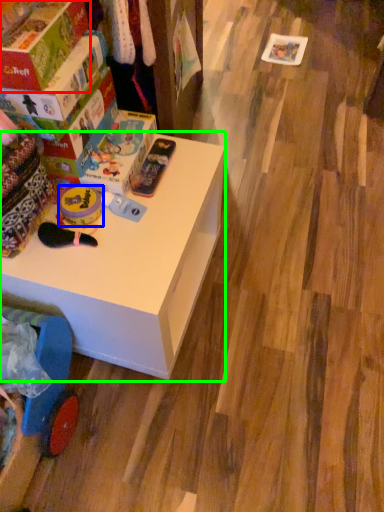
Question: Based on their relative distances, which object is farther from box (highlighted by a red box)? Choose from toy (highlighted by a blue box) and table (highlighted by a green box).

Choices:
 (A) toy
 (B) table

Answer: (B)